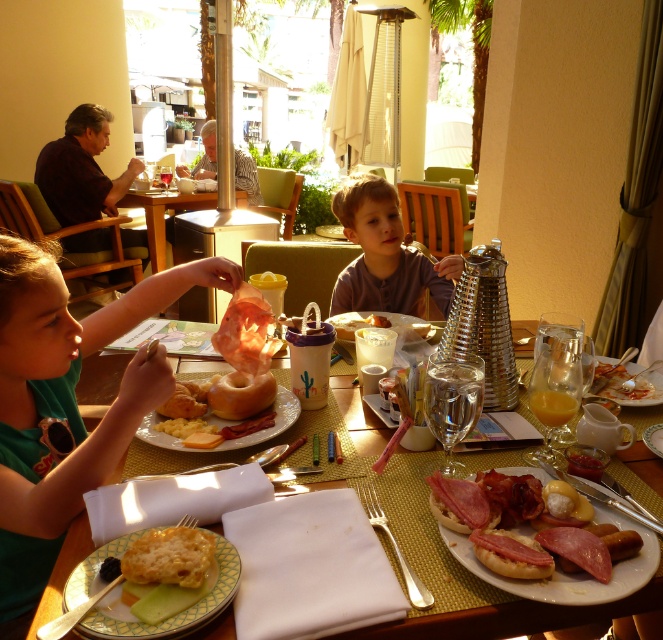
Question: Does matte plastic fork at lower center appear on the right side of matte plastic plate at center?

Choices:
 (A) yes
 (B) no

Answer: (A)

Question: Can you confirm if matte plastic fork at lower center is thinner than matte brown bagel at center?

Choices:
 (A) yes
 (B) no

Answer: (B)

Question: Is yellowish matte bread at lower left positioned before translucent glass juice at table center?

Choices:
 (A) yes
 (B) no

Answer: (A)

Question: Which is farther from the green matte shirt at upper left?

Choices:
 (A) matte brown bagel at center
 (B) smooth pink ham at center

Answer: (B)

Question: Which point is closer to the camera taking this photo?

Choices:
 (A) (274, 424)
 (B) (127, 192)
 (C) (247, 396)

Answer: (A)

Question: Considering the real-world distances, which object is closest to the wooden table at center?

Choices:
 (A) smooth pink ham at center
 (B) purple matte shirt at center
 (C) yellowish matte bread at lower left
 (D) matte brown bagel at center

Answer: (B)